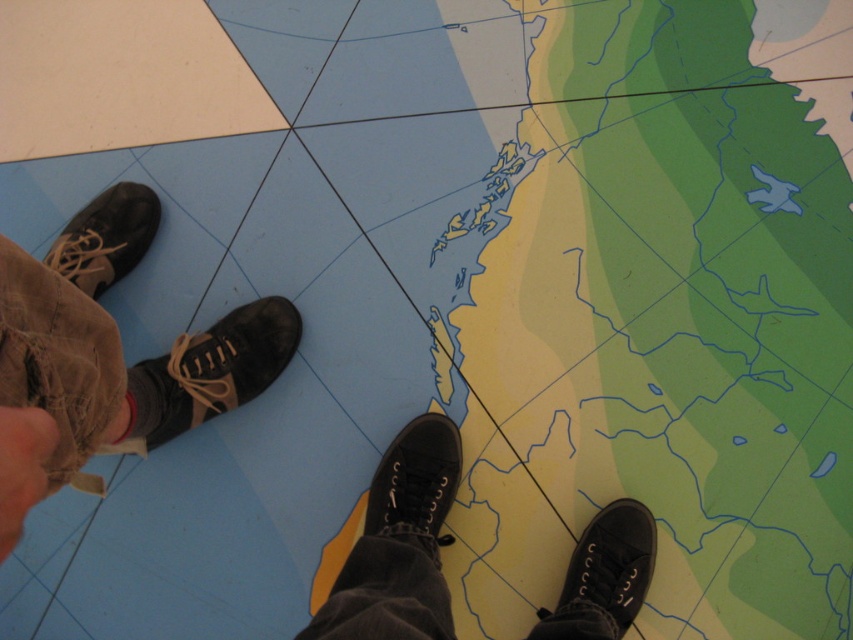
Which of these two, black canvas shoe at lower right or matte black shoe at left, stands taller?

black canvas shoe at lower right is taller.

Is the position of black canvas shoe at lower right more distant than that of matte black shoe at left?

No, it is in front of matte black shoe at left.

Does point (590, 561) lie behind point (122, 269)?

No.

You are a GUI agent. You are given a task and a screenshot of the screen. Output one action in this format:
    pyautogui.click(x=<x>, y=<y>)
    Task: Click on the black canvas shoe at lower right
    Image resolution: width=853 pixels, height=640 pixels.
    Given the screenshot: What is the action you would take?
    click(612, 563)

Between black canvas shoes at center and matte black shoe at left, which one has more height?

black canvas shoes at center

Which is more to the right, black canvas shoes at center or matte black shoe at left?

From the viewer's perspective, black canvas shoes at center appears more on the right side.

Describe the element at coordinates (399, 544) in the screenshot. I see `black canvas shoes at center` at that location.

Locate an element on the screen. The image size is (853, 640). black canvas shoes at center is located at coordinates (399, 544).

Between point (698, 52) and point (442, 500), which one is positioned in front?

Point (442, 500)

Is green matte map at center bigger than black leather shoe at center?

Correct, green matte map at center is larger in size than black leather shoe at center.

Describe the element at coordinates (660, 310) in the screenshot. This screenshot has width=853, height=640. I see `green matte map at center` at that location.

This screenshot has height=640, width=853. Identify the location of green matte map at center. (660, 310).